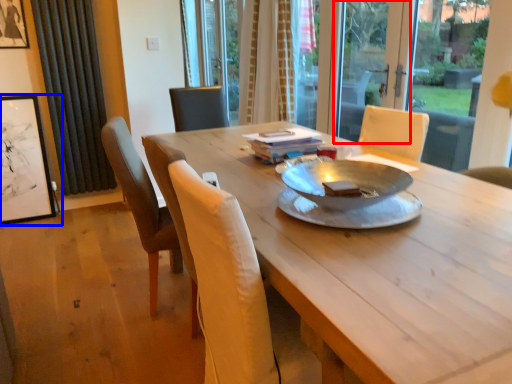
Question: Which point is closer to the camera, screen door (highlighted by a red box) or picture frame (highlighted by a blue box)?

Choices:
 (A) screen door
 (B) picture frame

Answer: (A)